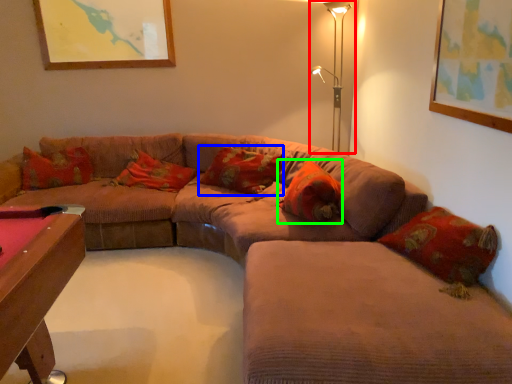
Question: Estimate the real-world distances between objects in this image. Which object is farther from table lamp (highlighted by a red box), pillow (highlighted by a blue box) or pillow (highlighted by a green box)?

Choices:
 (A) pillow
 (B) pillow

Answer: (B)